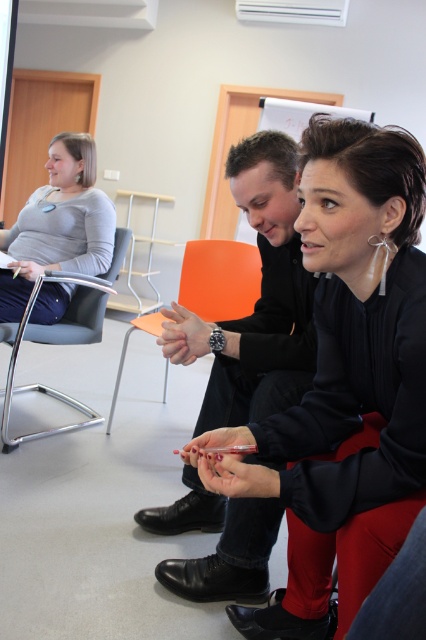
Can you confirm if orange plastic chair at center is positioned above metallic gray chair at left?

Indeed, orange plastic chair at center is positioned over metallic gray chair at left.

Is point (232, 314) more distant than point (5, 445)?

Yes, it is behind point (5, 445).

Find the location of a particular element. orange plastic chair at center is located at coordinates (219, 278).

Can you confirm if matte gray sweater at left is taller than metallic gray chair at left?

In fact, matte gray sweater at left may be shorter than metallic gray chair at left.

Between matte gray sweater at left and metallic gray chair at left, which one appears on the left side from the viewer's perspective?

matte gray sweater at left

Is point (51, 188) positioned before point (34, 433)?

No, (51, 188) is behind (34, 433).

Image resolution: width=426 pixels, height=640 pixels. I want to click on matte gray sweater at left, so click(x=57, y=225).

Between matte gray sweater at left and orange plastic chair at center, which one appears on the right side from the viewer's perspective?

From the viewer's perspective, orange plastic chair at center appears more on the right side.

Between point (72, 200) and point (222, 298), which one is positioned behind?

Point (222, 298)

Where is `matte gray sweater at left`? matte gray sweater at left is located at coordinates (57, 225).